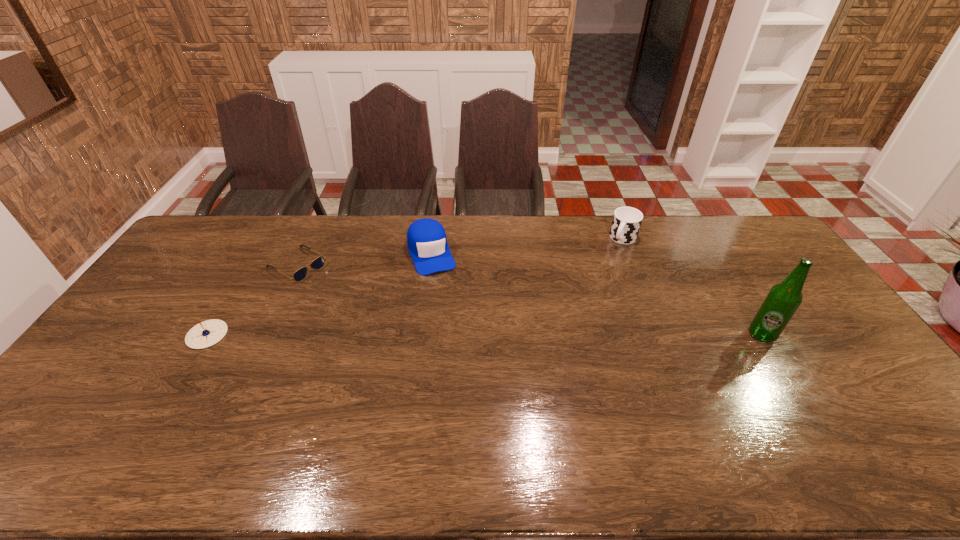
The width and height of the screenshot is (960, 540). Find the location of `vacant area that lies between the cup and the sunglasses`. vacant area that lies between the cup and the sunglasses is located at coordinates (460, 252).

Image resolution: width=960 pixels, height=540 pixels. Find the location of `vacant region between the cup and the shortest object`. vacant region between the cup and the shortest object is located at coordinates (460, 252).

At what (x,y) coordinates should I click in order to perform the action: click on free spot between the fourth object from left to right and the third object from right to left. Please return your answer as a coordinate pair (x, y). The width and height of the screenshot is (960, 540). Looking at the image, I should click on (527, 246).

At what (x,y) coordinates should I click in order to perform the action: click on free space that is in between the cup and the third object from left to right. Please return your answer as a coordinate pair (x, y). Looking at the image, I should click on point(527,246).

Locate an element on the screen. empty space that is in between the tallest object and the fourth tallest object is located at coordinates (485, 335).

Where is `vacant point located between the baseball cap and the sunglasses`? vacant point located between the baseball cap and the sunglasses is located at coordinates (364, 259).

You are a GUI agent. You are given a task and a screenshot of the screen. Output one action in this format:
    pyautogui.click(x=<x>, y=<y>)
    Task: Click on the fourth closest object to the tallest object
    This screenshot has height=540, width=960.
    Given the screenshot: What is the action you would take?
    pyautogui.click(x=207, y=333)

Locate which object ranks in proximity to the cup. Please provide its 2D coordinates. Your answer should be formatted as a tuple, i.e. [(x, y)], where the tuple contains the x and y coordinates of a point satisfying the conditions above.

[(782, 301)]

This screenshot has width=960, height=540. Identify the location of vacant point that satisfies the following two spatial constraints: 1. on the back side of the baseball cap; 2. on the right side of the fourth object from right to left. (303, 253).